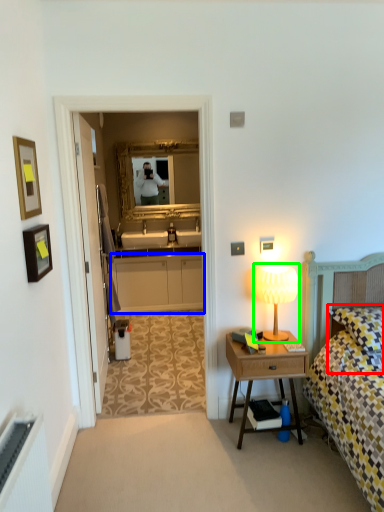
Question: Considering the real-world distances, which object is closest to pillow (highlighted by a red box)? cabinetry (highlighted by a blue box) or table lamp (highlighted by a green box).

Choices:
 (A) cabinetry
 (B) table lamp

Answer: (B)